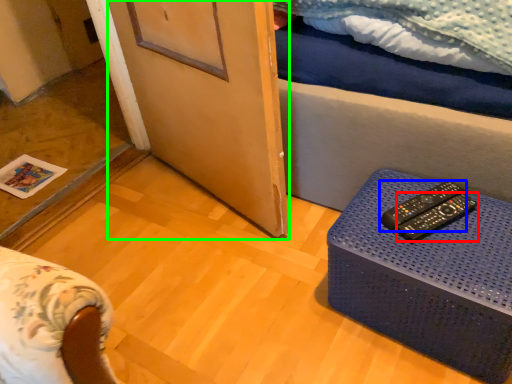
Question: Which object is the closest to the remote control (highlighted by a red box)? Choose among these: remote control (highlighted by a blue box) or screen door (highlighted by a green box).

Choices:
 (A) remote control
 (B) screen door

Answer: (A)